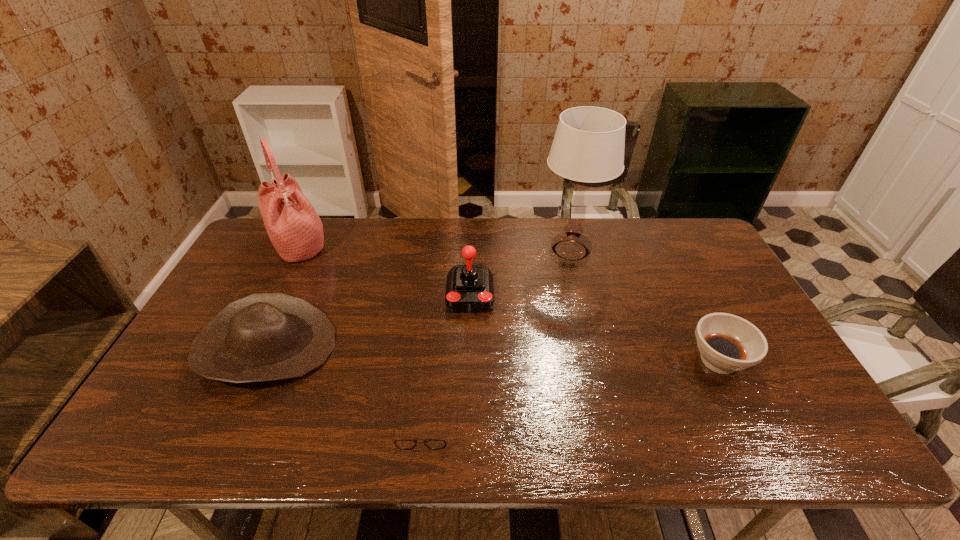
In order to click on blank area in the image that satisfies the following two spatial constraints: 1. on the front-facing side of the second object from right to left; 2. on the right side of the rightmost object in this screenshot , I will do `click(597, 360)`.

You are a GUI agent. You are given a task and a screenshot of the screen. Output one action in this format:
    pyautogui.click(x=<x>, y=<y>)
    Task: Click on the free region that satisfies the following two spatial constraints: 1. on the front side of the rightmost object; 2. on the right side of the fourth tallest object
    This screenshot has height=540, width=960.
    Given the screenshot: What is the action you would take?
    pyautogui.click(x=261, y=360)

Find the location of a particular element. free location that satisfies the following two spatial constraints: 1. on the front-facing side of the second object from right to left; 2. on the front side of the fourth tallest object is located at coordinates (594, 347).

Locate an element on the screen. Image resolution: width=960 pixels, height=540 pixels. free space that satisfies the following two spatial constraints: 1. on the front-facing side of the tallest object; 2. on the base of the fourth shortest object is located at coordinates (582, 295).